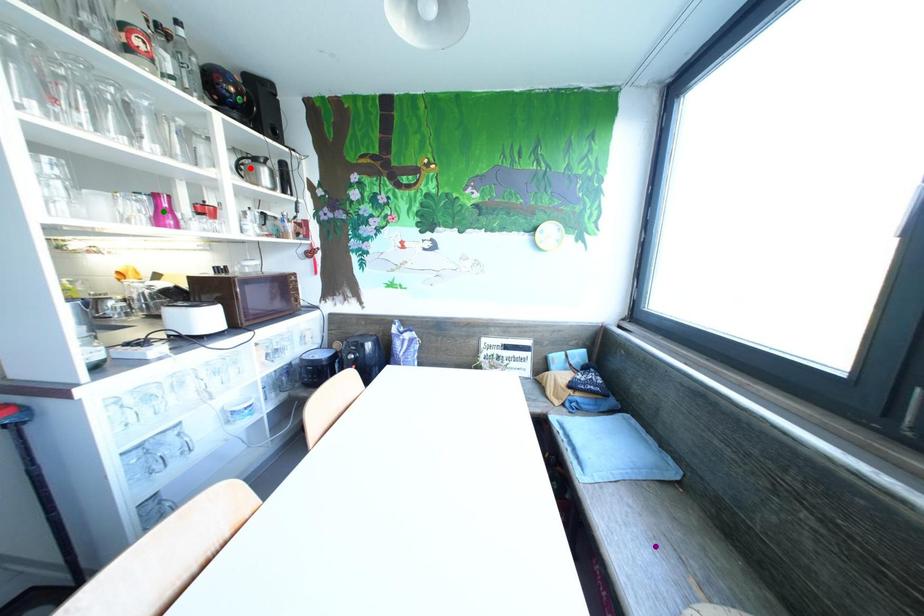
Order these from nearest to farthest:
A) purple point
B) green point
C) red point

purple point
green point
red point